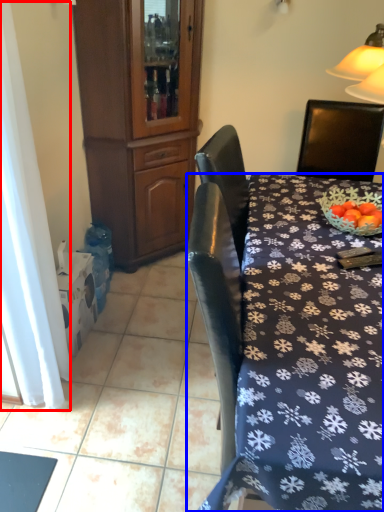
Question: Which object is further to the camera taking this photo, curtain (highlighted by a red box) or desk (highlighted by a blue box)?

Choices:
 (A) curtain
 (B) desk

Answer: (A)